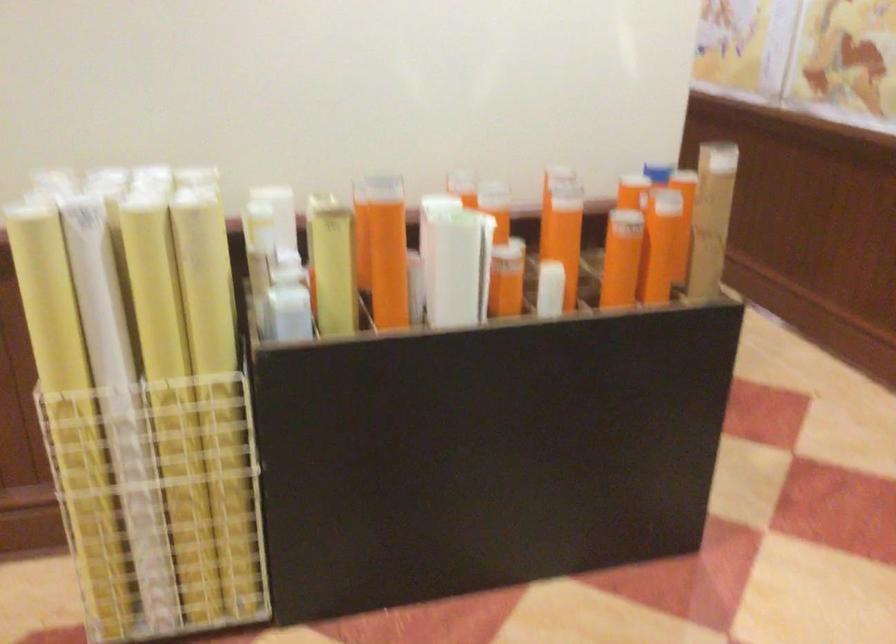
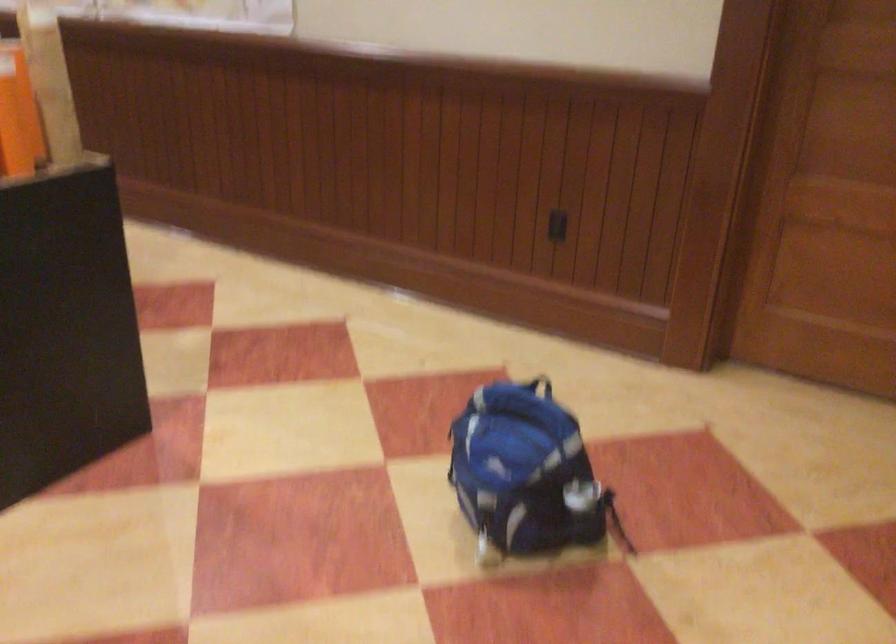
Question: Based on the continuous images, in which direction is the camera rotating? Reply with the corresponding letter.

Choices:
 (A) Left
 (B) Right
 (C) Up
 (D) Down

Answer: (B)